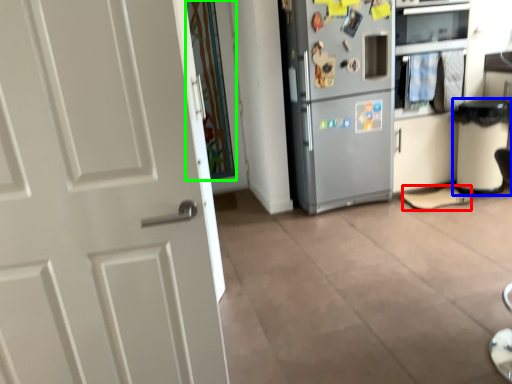
Question: Based on their relative distances, which object is farther from shoe (highlighted by a red box)? Choose from trash bin/can (highlighted by a blue box) and glass door (highlighted by a green box).

Choices:
 (A) trash bin/can
 (B) glass door

Answer: (B)